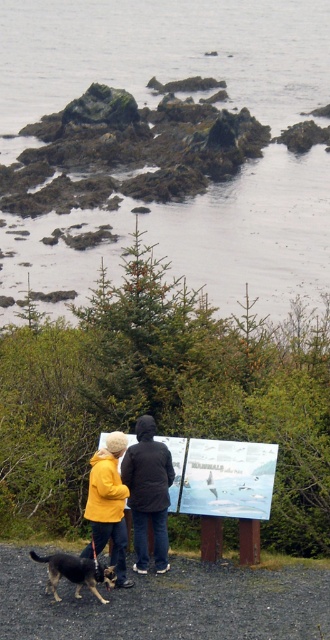
Question: Is gravelly dirt ground at lower center to the left of yellow woolen jacket at center from the viewer's perspective?

Choices:
 (A) yes
 (B) no

Answer: (B)

Question: Does gravelly dirt ground at lower center lie in front of yellow woolen jacket at center?

Choices:
 (A) yes
 (B) no

Answer: (A)

Question: Based on their relative distances, which object is nearer to the brown fur dog at lower left?

Choices:
 (A) grayish water at center
 (B) gravelly dirt ground at lower center

Answer: (B)

Question: Which point is farther to the camera?

Choices:
 (A) (155, 19)
 (B) (120, 452)

Answer: (A)

Question: Can you confirm if grayish water at center is positioned to the left of brown fur dog at lower left?

Choices:
 (A) yes
 (B) no

Answer: (B)

Question: Which point appears closest to the camera in this image?

Choices:
 (A) (29, 596)
 (B) (55, 588)

Answer: (B)